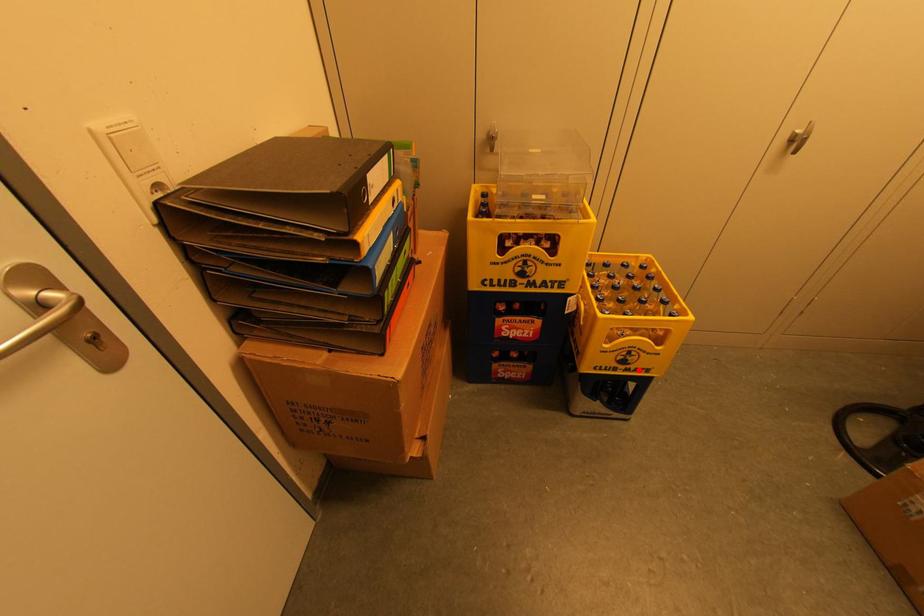
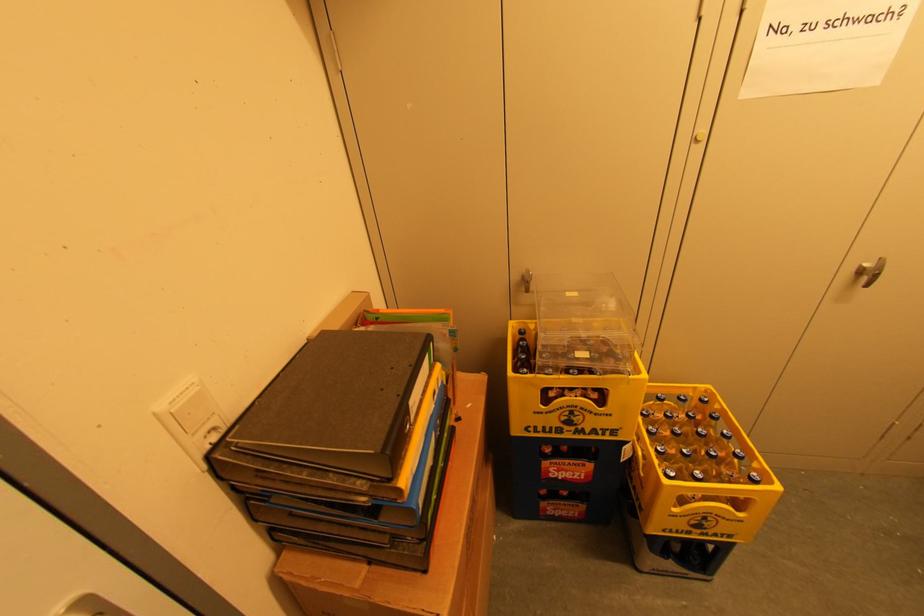
Question: I am providing you with two images of the same scene from different viewpoints. A red point is shown in image1. For the corresponding object point in image2, is it positioned nearer or farther from the camera?

Choices:
 (A) Nearer
 (B) Farther

Answer: (A)